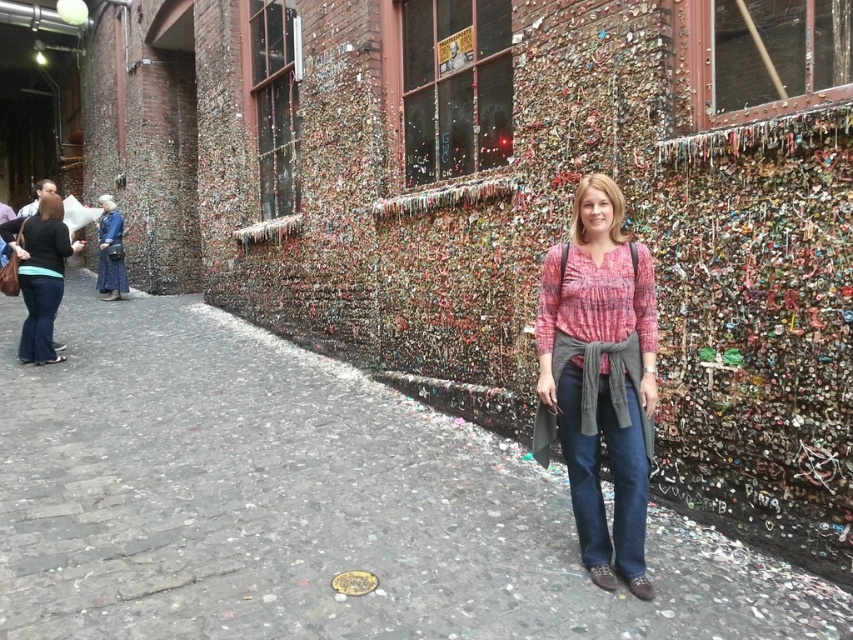
Question: Which of these objects is positioned closest to the matte pink blouse at center?

Choices:
 (A) gray cobblestone pavement at center
 (B) matte black shirt at left
 (C) denim dress at left

Answer: (A)

Question: Is matte black shirt at left smaller than denim dress at left?

Choices:
 (A) no
 (B) yes

Answer: (B)

Question: Which point appears closest to the camera in this image?

Choices:
 (A) (582, 304)
 (B) (45, 294)

Answer: (A)

Question: From the image, what is the correct spatial relationship of gray cobblestone pavement at center in relation to matte black shirt at left?

Choices:
 (A) right
 (B) left

Answer: (A)

Question: Is matte pink blouse at center to the left of matte black shirt at left from the viewer's perspective?

Choices:
 (A) yes
 (B) no

Answer: (B)

Question: Which point is farther to the camera?

Choices:
 (A) tap(581, 285)
 (B) tap(103, 216)
 (C) tap(50, 202)

Answer: (B)